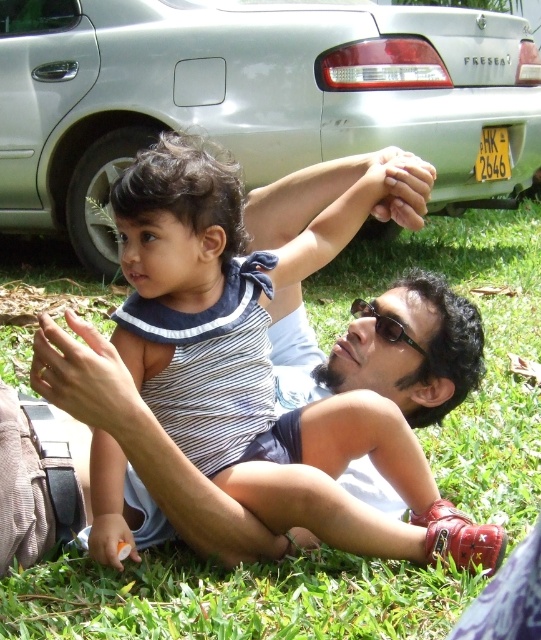
You are a gardener who needs to mow the lawn. The lawn mower you have can only operate on grass areas that are at least 4 meters away from any parked vehicles. Based on the scene, can you safely use the lawn mower near the green grass at center without being too close to the silver metallic car at upper center?

The distance between the silver metallic car at upper center and the green grass at center is 3.75 meters, which is less than the required 4 meters. Therefore, you cannot safely use the lawn mower near the green grass at center without being too close to the silver metallic car at upper center.

You are a photographer standing in the scene and want to take a photo of the silver metallic car at upper center and the green grass at center. Which object will appear closer to you in the photo?

The silver metallic car at upper center will appear closer to you in the photo because it is further to the viewer than the green grass at center, meaning it is positioned nearer to your vantage point.

You are standing at the origin point in the image. There are two points marked in the scene. Which point is closer to you? The points are labeled as point 1 at coordinates (480,28) and point 2 at coordinates (504,513).

Point 2 at coordinates (504,513) is closer to you because it is in front of point 1 at coordinates (480,28).